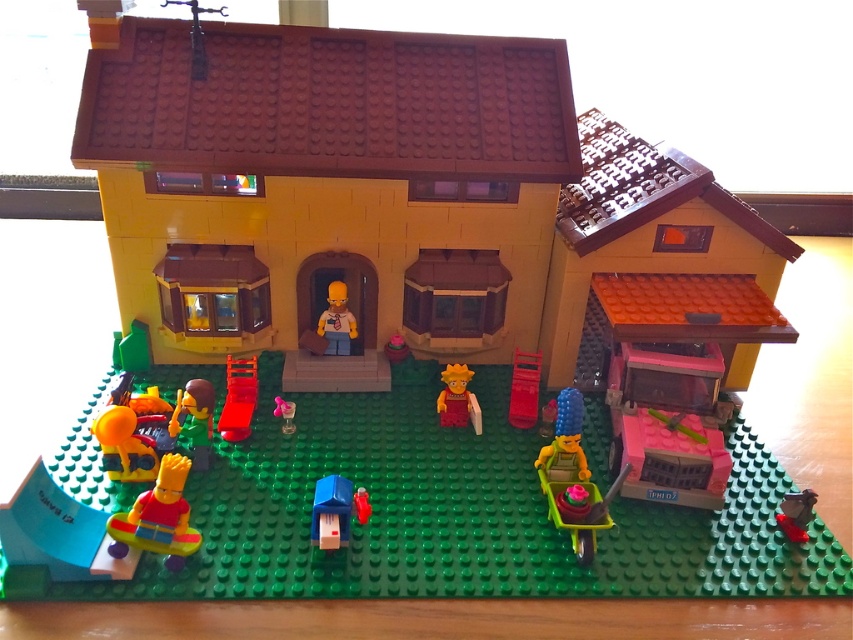
Between orange matte ball at lower left and transparent plastic ladder at center, which one is positioned higher?

transparent plastic ladder at center

Between point (157, 458) and point (236, 413), which one is positioned in front?

Positioned in front is point (157, 458).

Measure the distance between orange matte ball at lower left and camera.

A: orange matte ball at lower left is 36.00 inches from camera.

The width and height of the screenshot is (853, 640). What are the coordinates of `orange matte ball at lower left` in the screenshot? It's located at (125, 445).

Between translucent orange plastic watering can at lower center and transparent plastic ladder at center, which one appears on the left side from the viewer's perspective?

Positioned to the left is transparent plastic ladder at center.

From the picture: Can you confirm if translucent orange plastic watering can at lower center is wider than transparent plastic ladder at center?

Yes, translucent orange plastic watering can at lower center is wider than transparent plastic ladder at center.

Describe the element at coordinates (566, 436) in the screenshot. I see `translucent orange plastic watering can at lower center` at that location.

At what (x,y) coordinates should I click in order to perform the action: click on translucent orange plastic watering can at lower center. Please return your answer as a coordinate pair (x, y). Looking at the image, I should click on (566, 436).

Is transparent plastic ladder at center to the left of smooth plastic ladder at center right from the viewer's perspective?

Yes, transparent plastic ladder at center is to the left of smooth plastic ladder at center right.

Does transparent plastic ladder at center appear on the right side of smooth plastic ladder at center right?

Incorrect, transparent plastic ladder at center is not on the right side of smooth plastic ladder at center right.

You are a GUI agent. You are given a task and a screenshot of the screen. Output one action in this format:
    pyautogui.click(x=<x>, y=<y>)
    Task: Click on the transparent plastic ladder at center
    The image size is (853, 640).
    Given the screenshot: What is the action you would take?
    pyautogui.click(x=238, y=397)